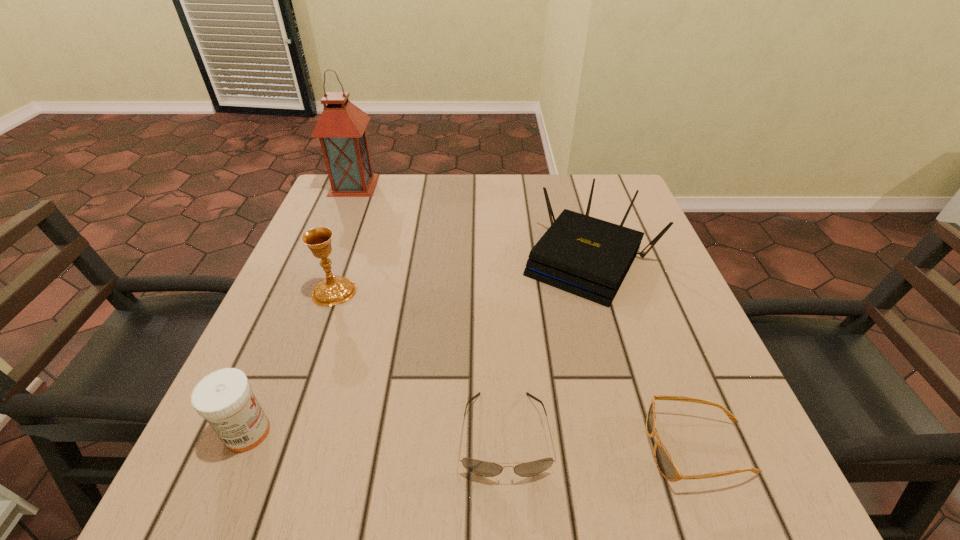
In order to click on vacant position located 0.270m on the back of the medicine in this screenshot , I will do `click(305, 296)`.

Find the location of a particular element. This screenshot has height=540, width=960. vacant area located 0.360m on the front-facing side of the right sunglasses is located at coordinates (414, 448).

Find the location of `free space located on the front-facing side of the right sunglasses`. free space located on the front-facing side of the right sunglasses is located at coordinates (551, 448).

Where is `vacant space situated 0.300m on the front-facing side of the right sunglasses`? This screenshot has height=540, width=960. vacant space situated 0.300m on the front-facing side of the right sunglasses is located at coordinates (453, 448).

Where is `lantern that is at the far edge`? The height and width of the screenshot is (540, 960). lantern that is at the far edge is located at coordinates (341, 127).

The width and height of the screenshot is (960, 540). In order to click on router located at the far edge in this screenshot , I will do `click(585, 256)`.

Find the location of a particular element. The width and height of the screenshot is (960, 540). medicine that is at the near edge is located at coordinates (224, 398).

Identify the location of lantern present at the left edge. This screenshot has height=540, width=960. (341, 127).

Locate an element on the screen. This screenshot has height=540, width=960. chalice that is at the left edge is located at coordinates (333, 290).

This screenshot has height=540, width=960. In order to click on medicine at the left edge in this screenshot , I will do `click(224, 398)`.